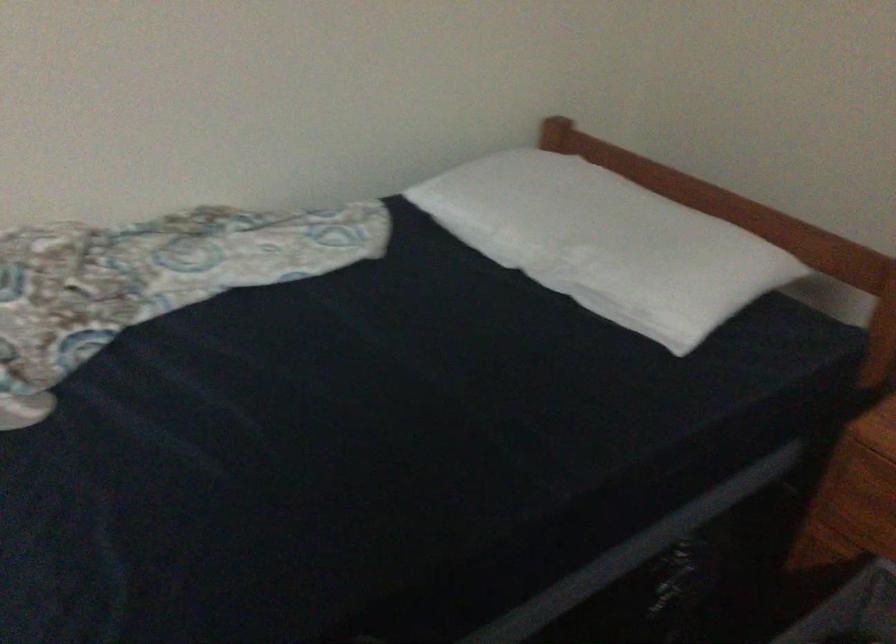
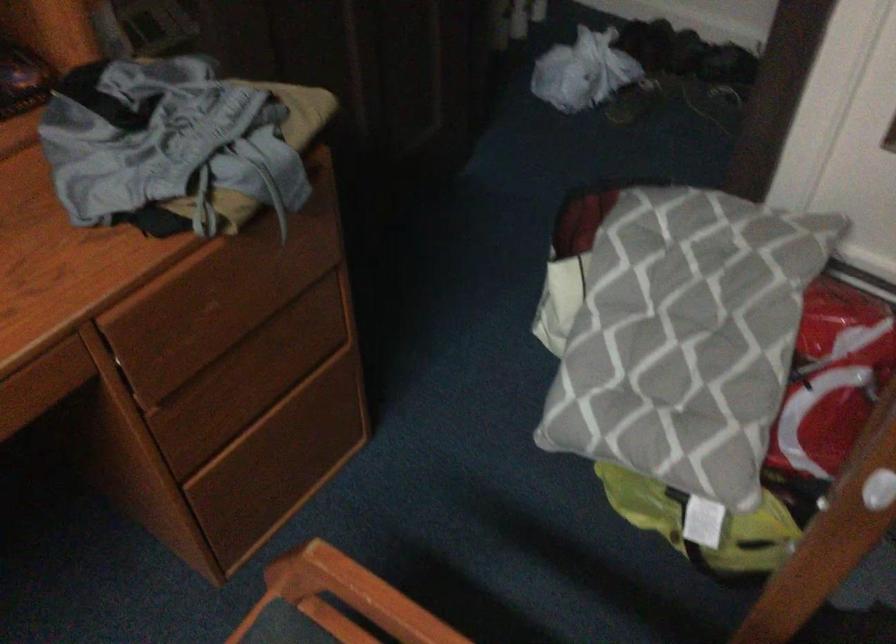
The images are taken continuously from a first-person perspective. In which direction is your viewpoint rotating?

The camera rotated toward left-down.